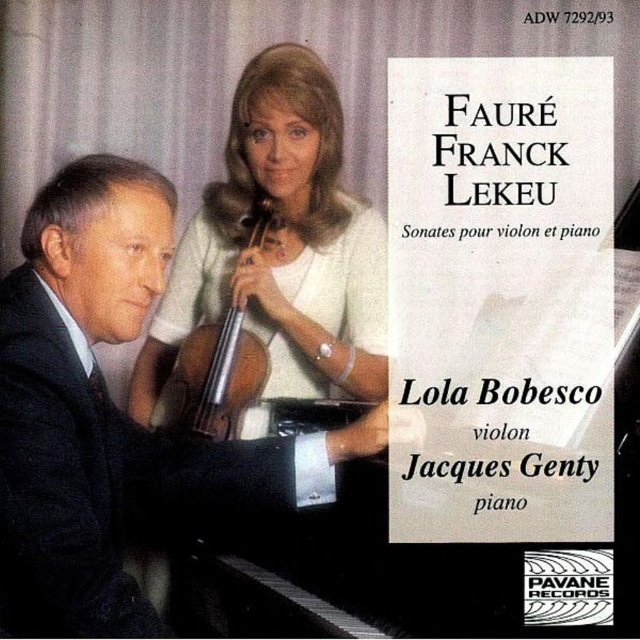
Question: Does black suit at left appear on the right side of matte white violin at upper center?

Choices:
 (A) yes
 (B) no

Answer: (B)

Question: Does black suit at left have a lesser width compared to matte white violin at upper center?

Choices:
 (A) no
 (B) yes

Answer: (A)

Question: Which of these objects is positioned closest to the matte white violin at upper center?

Choices:
 (A) wooden polished cello at center
 (B) black suit at left

Answer: (A)

Question: Among these objects, which one is nearest to the camera?

Choices:
 (A) matte white violin at upper center
 (B) black suit at left

Answer: (B)

Question: Is black suit at left thinner than wooden polished cello at center?

Choices:
 (A) no
 (B) yes

Answer: (A)

Question: Which point appears farthest from the camera in this image?

Choices:
 (A) (177, 364)
 (B) (216, 316)

Answer: (B)